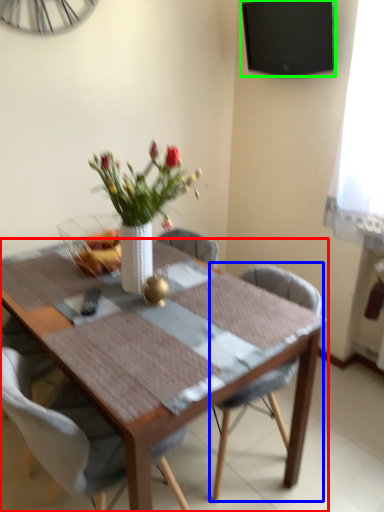
Question: Based on their relative distances, which object is farther from kitchen & dining room table (highlighted by a red box)? Choose from chair (highlighted by a blue box) and television (highlighted by a green box).

Choices:
 (A) chair
 (B) television

Answer: (B)